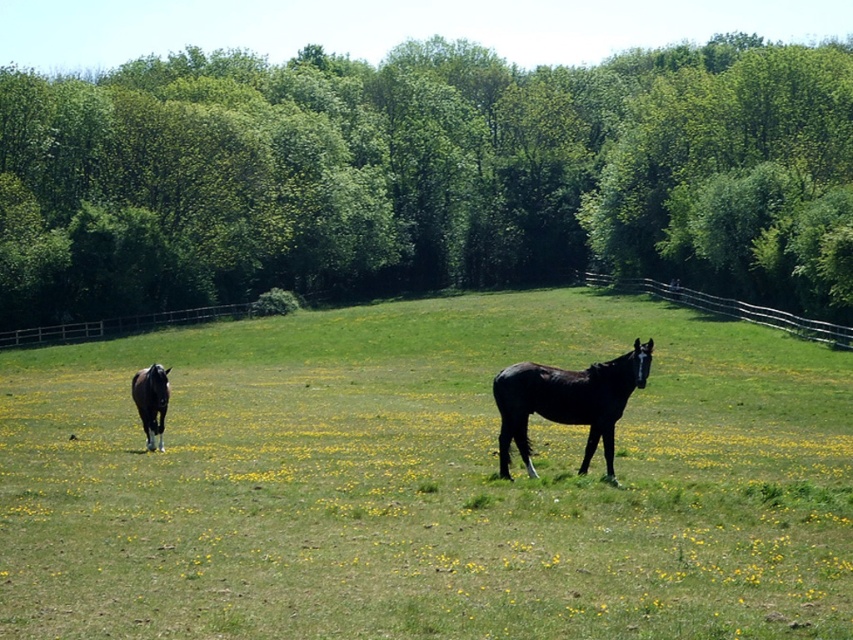
Who is shorter, black glossy horse at center or wooden fence at upper right?

With less height is wooden fence at upper right.

Is point (498, 380) closer to camera compared to point (679, 296)?

Yes, it is.

Is point (604, 432) less distant than point (677, 298)?

Yes, it is in front of point (677, 298).

Locate an element on the screen. The image size is (853, 640). black glossy horse at center is located at coordinates (567, 401).

Who is more distant from viewer, (94,492) or (593,86)?

Point (593,86)

Who is more forward, (451, 582) or (25, 218)?

Point (451, 582) is more forward.

Locate an element on the screen. green grass pasture at center is located at coordinates (427, 481).

Can you confirm if green leafy trees at upper center is taller than black glossy horse at center?

Yes, green leafy trees at upper center is taller than black glossy horse at center.

From the picture: Who is more distant from viewer, (689,157) or (607,458)?

The point (689,157) is behind.

Image resolution: width=853 pixels, height=640 pixels. I want to click on green leafy trees at upper center, so click(425, 176).